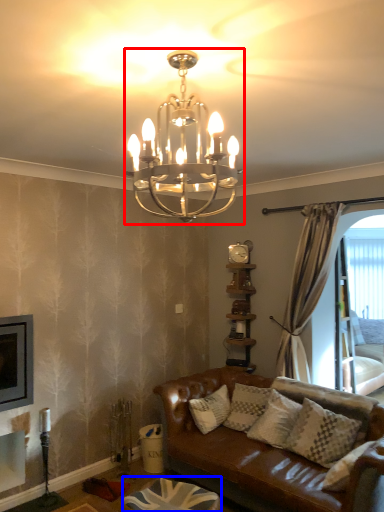
Question: Which point is further to the camera, lamp (highlighted by a red box) or footrest (highlighted by a blue box)?

Choices:
 (A) lamp
 (B) footrest

Answer: (B)